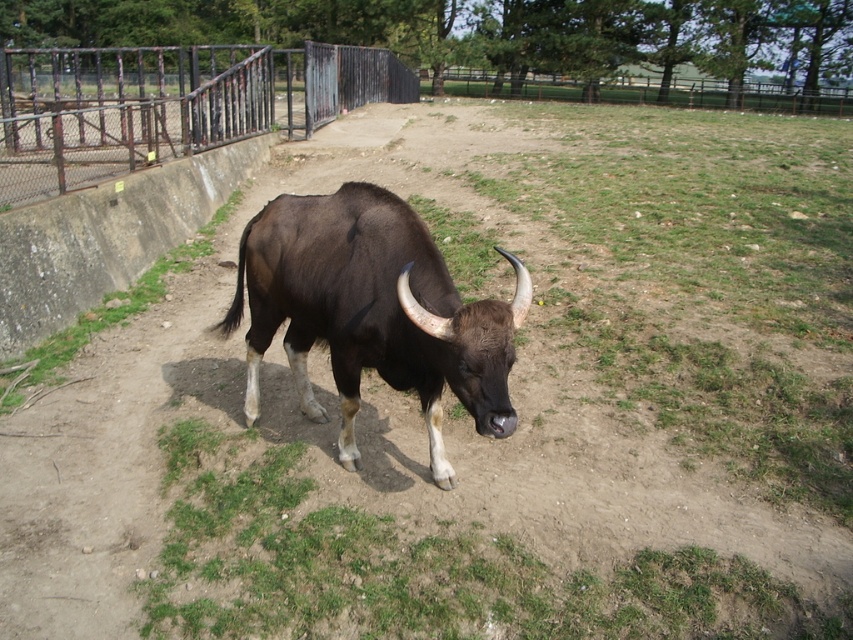
The image size is (853, 640). Describe the element at coordinates (372, 312) in the screenshot. I see `brown glossy bull at center` at that location.

This screenshot has width=853, height=640. I want to click on brown glossy bull at center, so [x=372, y=312].